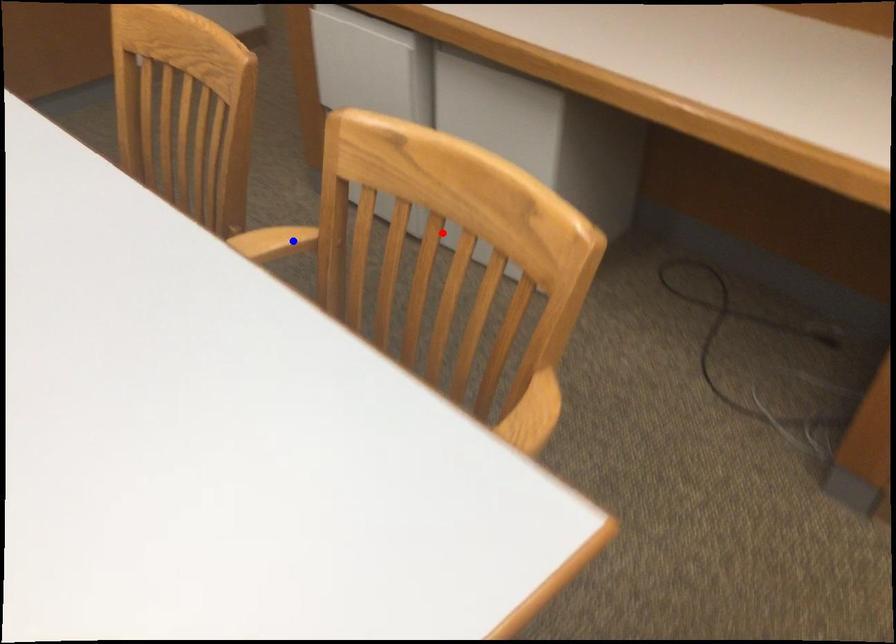
Question: Which of the two points in the image is closer to the camera?

Choices:
 (A) Blue point is closer.
 (B) Red point is closer.

Answer: (B)